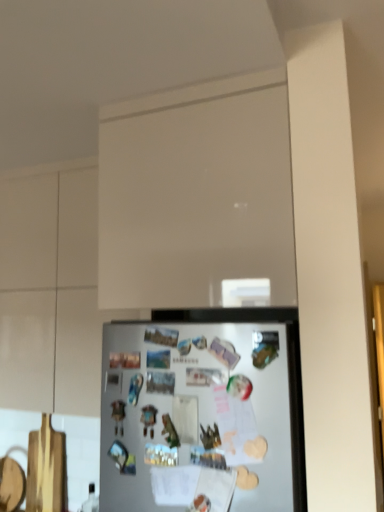
Question: Is white matte glass door at upper center positioned behind white matte cabinet at upper center?

Choices:
 (A) no
 (B) yes

Answer: (A)

Question: Does white matte glass door at upper center have a smaller size compared to white matte cabinet at upper center?

Choices:
 (A) yes
 (B) no

Answer: (A)

Question: Is white matte glass door at upper center not within white matte cabinet at upper center?

Choices:
 (A) no
 (B) yes

Answer: (B)

Question: Does white matte glass door at upper center contain white matte cabinet at upper center?

Choices:
 (A) yes
 (B) no

Answer: (B)

Question: Does white matte glass door at upper center touch white matte cabinet at upper center?

Choices:
 (A) no
 (B) yes

Answer: (A)

Question: Is white matte glass door at upper center situated inside white matte cabinet at upper center or outside?

Choices:
 (A) outside
 (B) inside

Answer: (A)

Question: In terms of width, does white matte glass door at upper center look wider or thinner when compared to white matte cabinet at upper center?

Choices:
 (A) thin
 (B) wide

Answer: (B)

Question: In the image, is white matte glass door at upper center positioned in front of or behind white matte cabinet at upper center?

Choices:
 (A) behind
 (B) front

Answer: (B)

Question: From their relative heights in the image, would you say white matte glass door at upper center is taller or shorter than white matte cabinet at upper center?

Choices:
 (A) short
 (B) tall

Answer: (A)

Question: Considering the positions of white matte glass door at upper center and white matte refrigerator at lower center in the image, is white matte glass door at upper center bigger or smaller than white matte refrigerator at lower center?

Choices:
 (A) big
 (B) small

Answer: (A)

Question: In terms of height, does white matte glass door at upper center look taller or shorter compared to white matte refrigerator at lower center?

Choices:
 (A) short
 (B) tall

Answer: (B)

Question: From the image's perspective, is white matte glass door at upper center located above or below white matte refrigerator at lower center?

Choices:
 (A) above
 (B) below

Answer: (A)

Question: Considering the positions of white matte glass door at upper center and white matte refrigerator at lower center in the image, is white matte glass door at upper center wider or thinner than white matte refrigerator at lower center?

Choices:
 (A) wide
 (B) thin

Answer: (A)

Question: In terms of size, does white matte refrigerator at lower center appear bigger or smaller than white matte glass door at upper center?

Choices:
 (A) big
 (B) small

Answer: (B)

Question: Which is correct: white matte refrigerator at lower center is inside white matte glass door at upper center, or outside of it?

Choices:
 (A) outside
 (B) inside

Answer: (A)